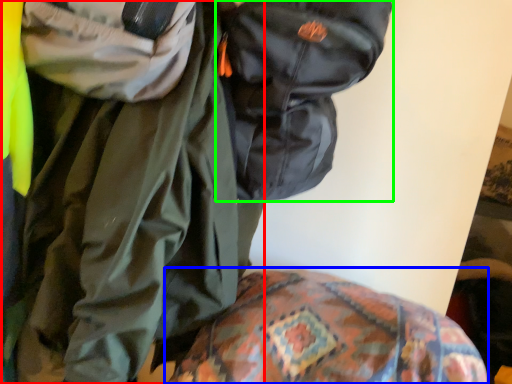
Question: Which object is positioned closest to jacket (highlighted by a red box)? Select from bedding (highlighted by a blue box) and backpack (highlighted by a green box).

Choices:
 (A) bedding
 (B) backpack

Answer: (B)